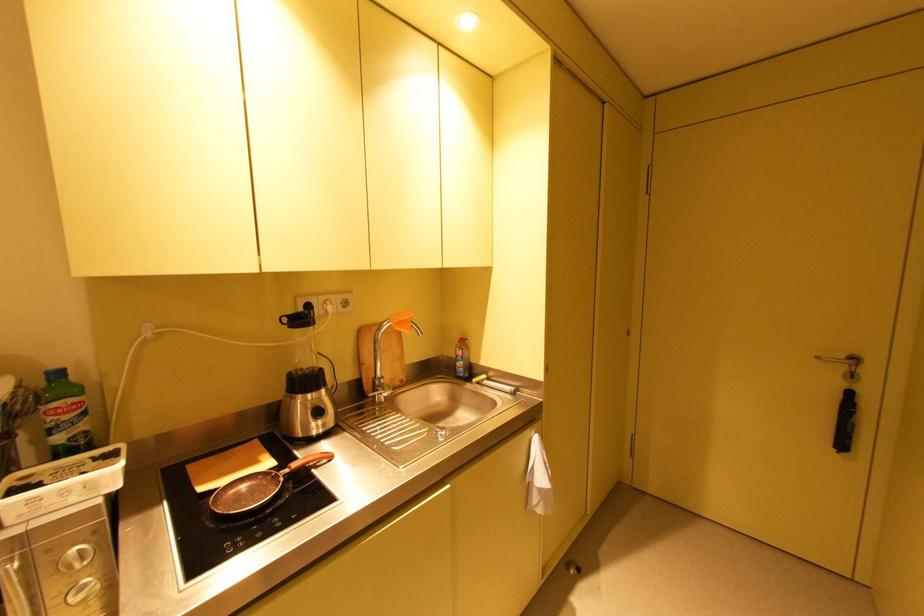
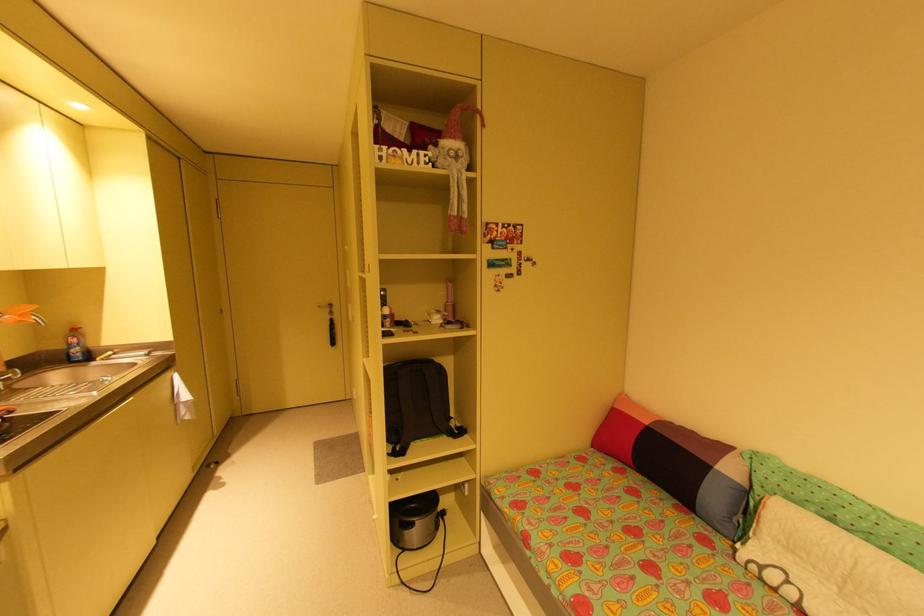
The point at (468, 341) is marked in the first image. Where is the corresponding point in the second image?

(79, 331)